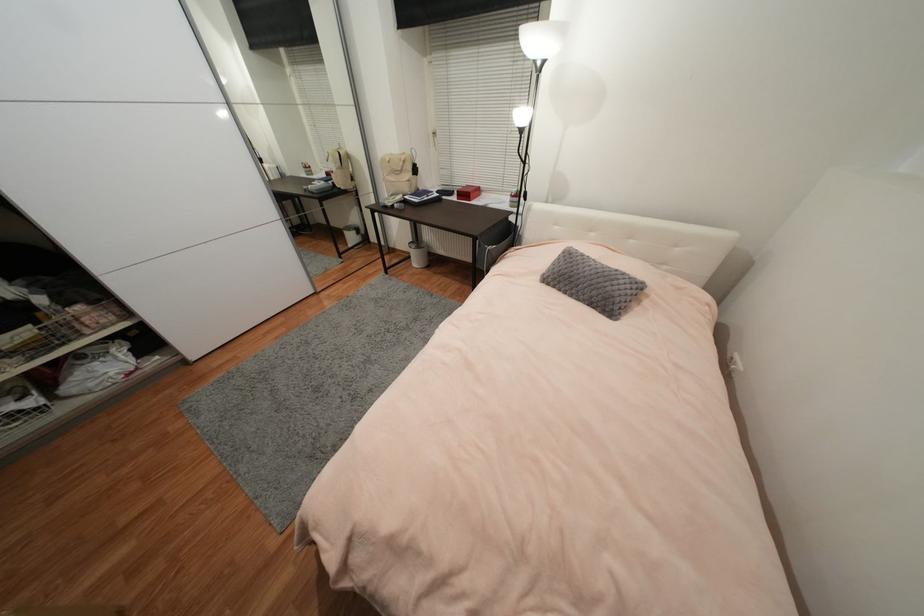
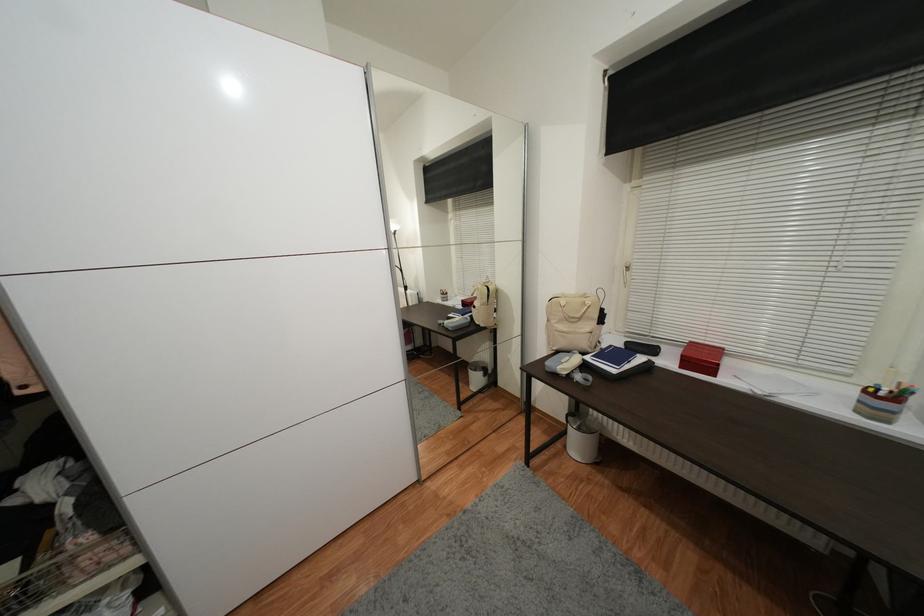
The point at (451, 49) is marked in the first image. Where is the corresponding point in the second image?

(678, 167)